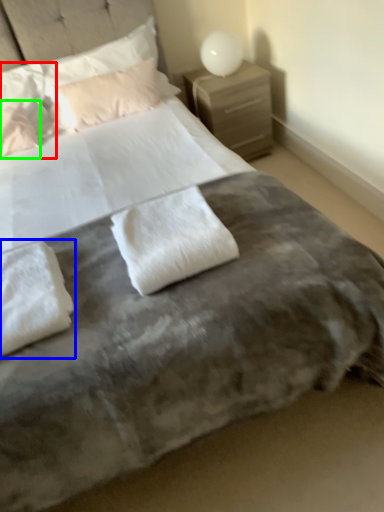
Question: Based on their relative distances, which object is farther from pillow (highlighted by a red box)? Choose from pillow (highlighted by a blue box) and pillow (highlighted by a green box).

Choices:
 (A) pillow
 (B) pillow

Answer: (A)